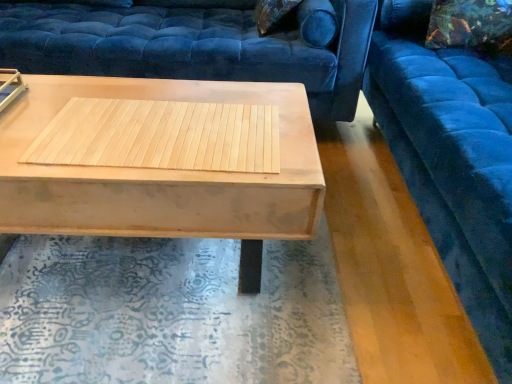
Question: From a real-world perspective, is natural wood mat at center under velvet blue studio couch at upper right, the 2th studio couch in the left-to-right sequence?

Choices:
 (A) yes
 (B) no

Answer: (B)

Question: Is natural wood mat at center beside velvet blue studio couch at upper right, which is the first studio couch from right to left?

Choices:
 (A) yes
 (B) no

Answer: (B)

Question: Can you confirm if natural wood mat at center is thinner than velvet blue studio couch at upper right, the 2th studio couch in the left-to-right sequence?

Choices:
 (A) yes
 (B) no

Answer: (A)

Question: Can you confirm if natural wood mat at center is smaller than velvet blue studio couch at upper right, which is the first studio couch from right to left?

Choices:
 (A) yes
 (B) no

Answer: (A)

Question: Does natural wood mat at center have a greater width compared to velvet blue studio couch at upper right, which is the first studio couch from right to left?

Choices:
 (A) no
 (B) yes

Answer: (A)

Question: From a real-world perspective, relative to velvet blue studio couch at upper right, the 2th studio couch in the left-to-right sequence, is natural wood mat at center vertically above or below?

Choices:
 (A) above
 (B) below

Answer: (A)

Question: Is natural wood mat at center wider or thinner than velvet blue studio couch at upper right, the 2th studio couch in the left-to-right sequence?

Choices:
 (A) wide
 (B) thin

Answer: (B)

Question: Which is correct: natural wood mat at center is inside velvet blue studio couch at upper right, the 2th studio couch in the left-to-right sequence, or outside of it?

Choices:
 (A) inside
 (B) outside

Answer: (B)

Question: From the image's perspective, is natural wood mat at center located above or below velvet blue studio couch at upper right, which is the first studio couch from right to left?

Choices:
 (A) below
 (B) above

Answer: (A)

Question: Considering the positions of velvet blue studio couch at upper center, acting as the 1th studio couch starting from the left, and light wood/texture coffee table at center in the image, is velvet blue studio couch at upper center, acting as the 1th studio couch starting from the left, wider or thinner than light wood/texture coffee table at center?

Choices:
 (A) wide
 (B) thin

Answer: (A)

Question: In the image, is velvet blue studio couch at upper center, acting as the 1th studio couch starting from the left, positioned in front of or behind light wood/texture coffee table at center?

Choices:
 (A) front
 (B) behind

Answer: (B)

Question: Which is correct: velvet blue studio couch at upper center, acting as the 1th studio couch starting from the left, is inside light wood/texture coffee table at center, or outside of it?

Choices:
 (A) inside
 (B) outside

Answer: (B)

Question: From a real-world perspective, is velvet blue studio couch at upper center, placed as the second studio couch when sorted from right to left, above or below light wood/texture coffee table at center?

Choices:
 (A) above
 (B) below

Answer: (A)

Question: From a real-world perspective, is light wood/texture coffee table at center physically located above or below velvet blue studio couch at upper right, which is the first studio couch from right to left?

Choices:
 (A) below
 (B) above

Answer: (A)

Question: Considering the positions of light wood/texture coffee table at center and velvet blue studio couch at upper right, which is the first studio couch from right to left, in the image, is light wood/texture coffee table at center wider or thinner than velvet blue studio couch at upper right, which is the first studio couch from right to left,?

Choices:
 (A) thin
 (B) wide

Answer: (A)